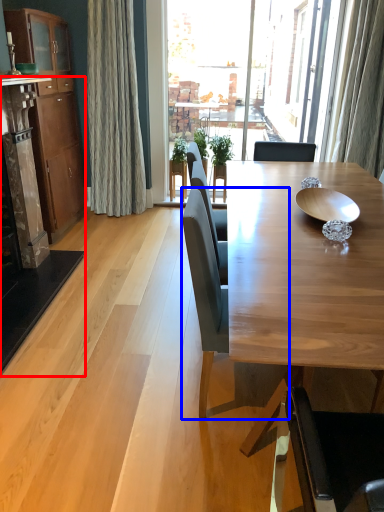
Question: Which point is closer to the camera, fireplace (highlighted by a red box) or chair (highlighted by a blue box)?

Choices:
 (A) fireplace
 (B) chair

Answer: (B)